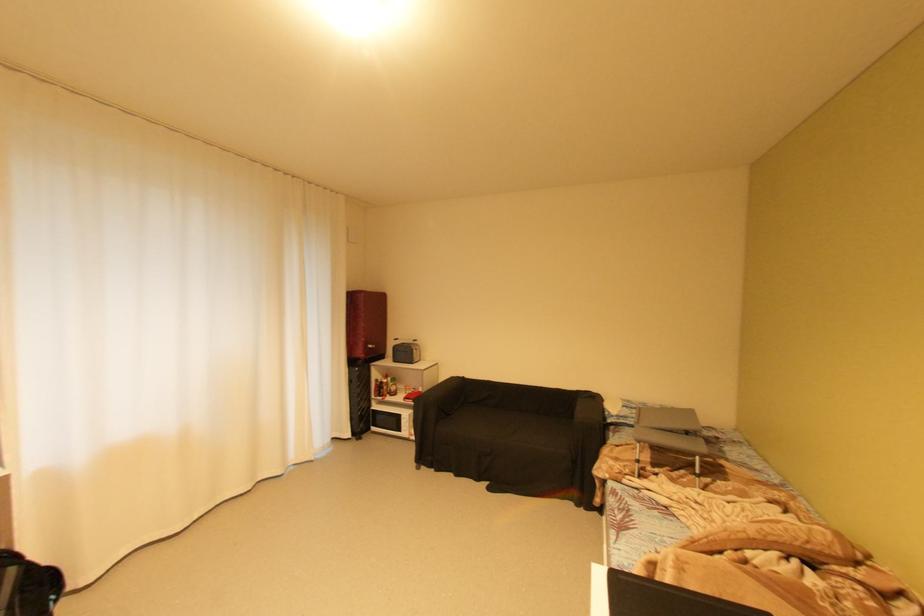
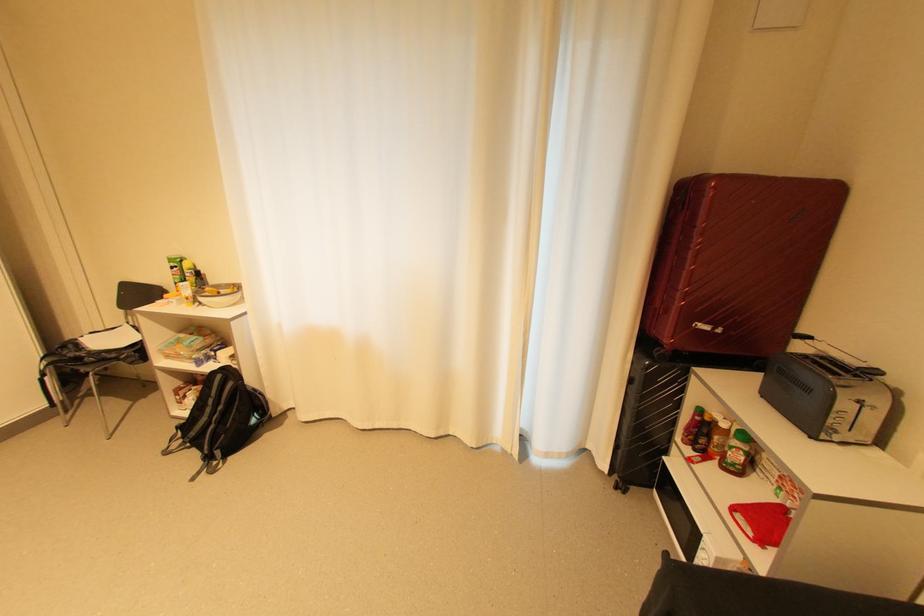
The point at (400, 392) is marked in the first image. Where is the corresponding point in the second image?

(739, 466)